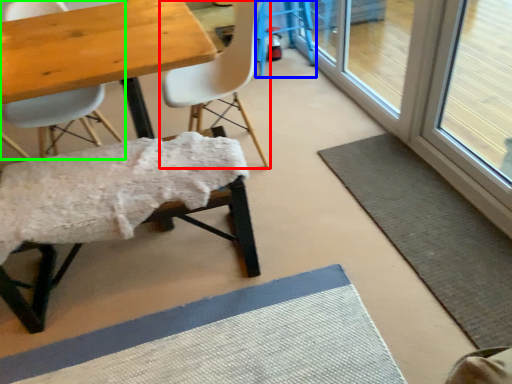
Question: Which is nearer to the chair (highlighted by a red box)? bar stool (highlighted by a blue box) or chair (highlighted by a green box).

Choices:
 (A) bar stool
 (B) chair

Answer: (B)